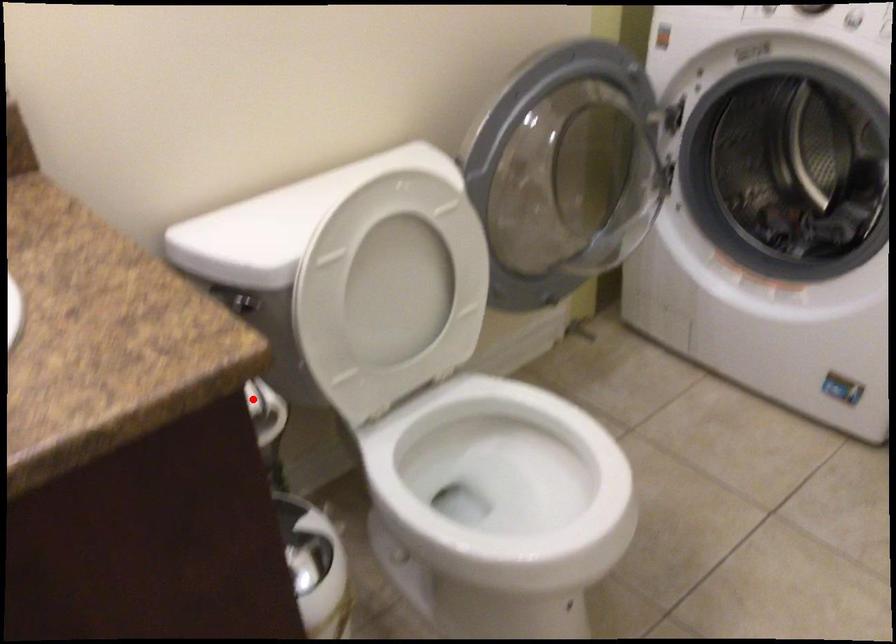
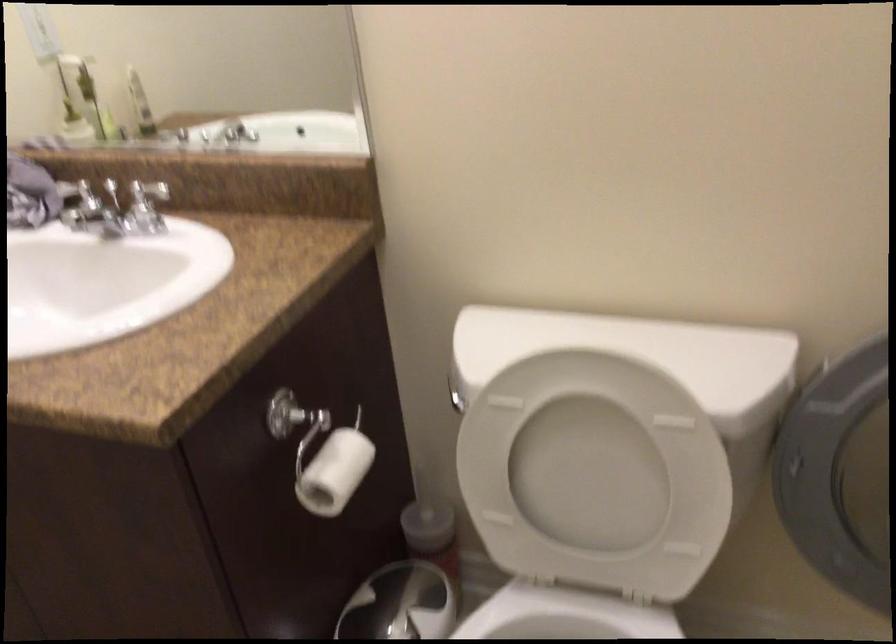
The point at the highlighted location is marked in the first image. Where is the corresponding point in the second image?

(334, 471)